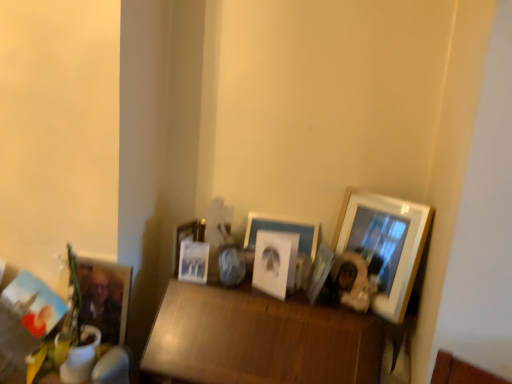
Question: Does matte white picture frame at center, positioned as the 3th picture frame in left-to-right order, have a larger size compared to matte wooden picture frame at lower left, the 2th picture frame from the left?

Choices:
 (A) no
 (B) yes

Answer: (A)

Question: Considering the relative sizes of matte white picture frame at center, positioned as the 3th picture frame in left-to-right order, and matte wooden picture frame at lower left, the 2th picture frame from the left, in the image provided, is matte white picture frame at center, positioned as the 3th picture frame in left-to-right order, taller than matte wooden picture frame at lower left, the 2th picture frame from the left,?

Choices:
 (A) yes
 (B) no

Answer: (B)

Question: Can you confirm if matte white picture frame at center, positioned as the sixth picture frame in right-to-left order, is thinner than matte wooden picture frame at lower left, the 2th picture frame from the left?

Choices:
 (A) no
 (B) yes

Answer: (B)

Question: Is the depth of matte white picture frame at center, positioned as the 3th picture frame in left-to-right order, less than that of matte wooden picture frame at lower left, the 2th picture frame from the left?

Choices:
 (A) yes
 (B) no

Answer: (B)

Question: Does matte white picture frame at center, positioned as the sixth picture frame in right-to-left order, have a lesser height compared to matte wooden picture frame at lower left, the 2th picture frame from the left?

Choices:
 (A) no
 (B) yes

Answer: (B)

Question: Is wooden table at center inside or outside of matte black picture frame at lower left, placed as the first picture frame when sorted from left to right?

Choices:
 (A) outside
 (B) inside

Answer: (A)

Question: Considering the relative positions of wooden table at center and matte black picture frame at lower left, the 8th picture frame positioned from the right, in the image provided, is wooden table at center to the left or to the right of matte black picture frame at lower left, the 8th picture frame positioned from the right,?

Choices:
 (A) right
 (B) left

Answer: (A)

Question: Considering the positions of wooden table at center and matte black picture frame at lower left, the 8th picture frame positioned from the right, in the image, is wooden table at center wider or thinner than matte black picture frame at lower left, the 8th picture frame positioned from the right,?

Choices:
 (A) thin
 (B) wide

Answer: (B)

Question: From the image's perspective, is wooden table at center above or below matte black picture frame at lower left, placed as the first picture frame when sorted from left to right?

Choices:
 (A) below
 (B) above

Answer: (A)

Question: In terms of width, does matte white picture frame at center, which is the second picture frame in right-to-left order, look wider or thinner when compared to metallic silver photo frame at center, the 5th picture frame positioned from the right?

Choices:
 (A) thin
 (B) wide

Answer: (B)

Question: Is matte white picture frame at center, which is the second picture frame in right-to-left order, bigger or smaller than metallic silver photo frame at center, acting as the 4th picture frame starting from the left?

Choices:
 (A) big
 (B) small

Answer: (A)

Question: Considering their positions, is matte white picture frame at center, which is the second picture frame in right-to-left order, located in front of or behind metallic silver photo frame at center, acting as the 4th picture frame starting from the left?

Choices:
 (A) behind
 (B) front

Answer: (B)

Question: Is matte white picture frame at center, arranged as the seventh picture frame when viewed from the left, spatially inside metallic silver photo frame at center, acting as the 4th picture frame starting from the left, or outside of it?

Choices:
 (A) inside
 (B) outside

Answer: (B)

Question: Is point (290, 334) positioned closer to the camera than point (327, 248)?

Choices:
 (A) farther
 (B) closer

Answer: (B)

Question: From the image's perspective, is wooden table at center located above or below matte white picture frame at center, arranged as the seventh picture frame when viewed from the left?

Choices:
 (A) below
 (B) above

Answer: (A)